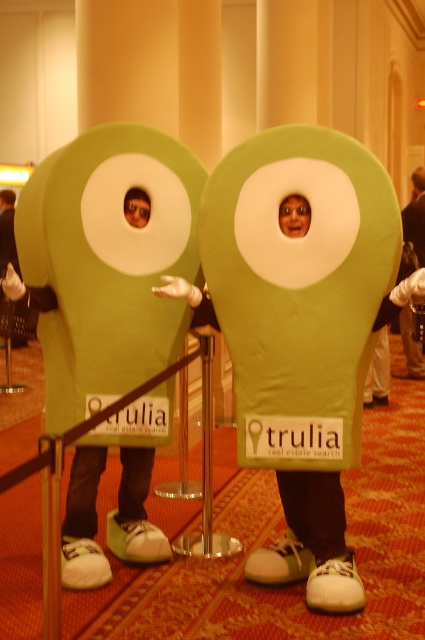
Between green fabric costume at center and smooth matte face at center, which one has less height?

smooth matte face at center

Does point (405, 314) lie behind point (308, 209)?

That is True.

The image size is (425, 640). I want to click on green fabric costume at center, so click(416, 216).

Is smooth matte face at center thinner than matte green eye at center?

No.

Does smooth matte face at center have a lesser height compared to matte green eye at center?

No, smooth matte face at center is not shorter than matte green eye at center.

Describe the element at coordinates (294, 216) in the screenshot. I see `smooth matte face at center` at that location.

At what (x,y) coordinates should I click in order to perform the action: click on smooth matte face at center. Please return your answer as a coordinate pair (x, y). Looking at the image, I should click on (294, 216).

Can you confirm if green fabric costume at center is smaller than matte green eye at center?

No, green fabric costume at center is not smaller than matte green eye at center.

Is green fabric costume at center bigger than matte green eye at center?

Yes, green fabric costume at center is bigger than matte green eye at center.

Locate an element on the screen. This screenshot has width=425, height=640. green fabric costume at center is located at coordinates (416, 216).